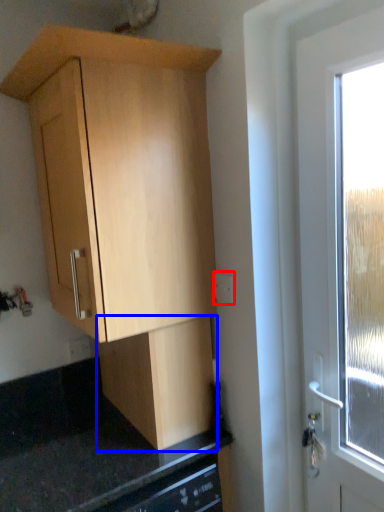
Question: Among these objects, which one is nearest to the camera, electric outlet (highlighted by a red box) or cabinetry (highlighted by a blue box)?

Choices:
 (A) electric outlet
 (B) cabinetry

Answer: (B)